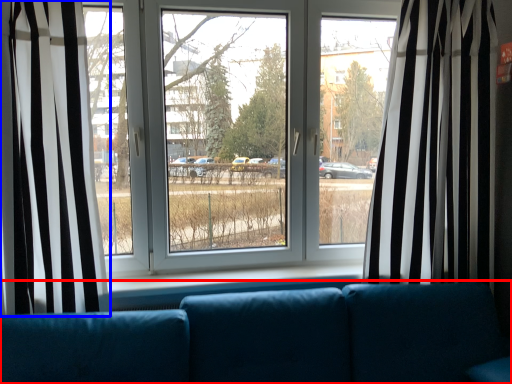
Question: Which of the following is the closest to the observer, studio couch (highlighted by a red box) or curtain (highlighted by a blue box)?

Choices:
 (A) studio couch
 (B) curtain

Answer: (A)